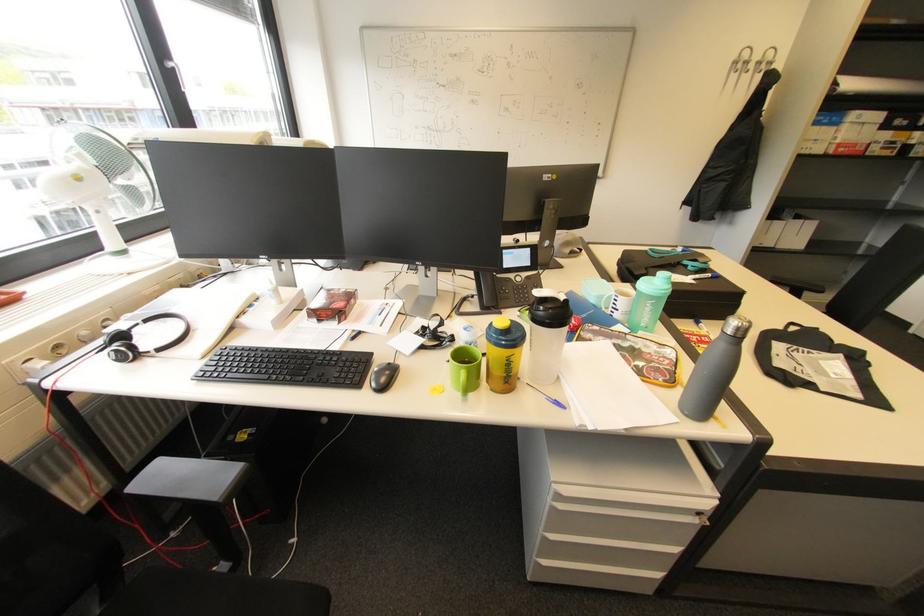
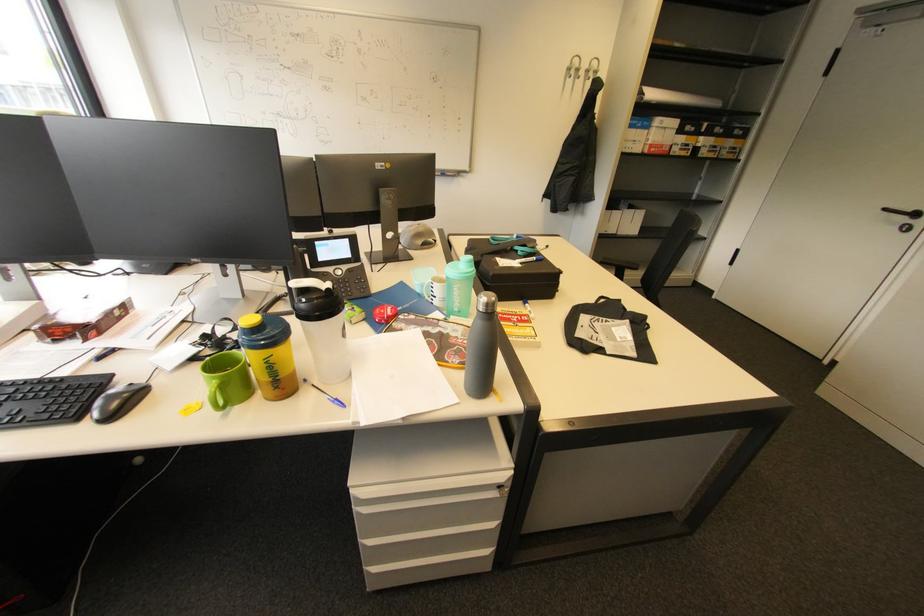
Question: In a continuous first-person perspective shot, in which direction is the camera moving?

Choices:
 (A) Left
 (B) Right
 (C) Forward
 (D) Backward

Answer: (B)